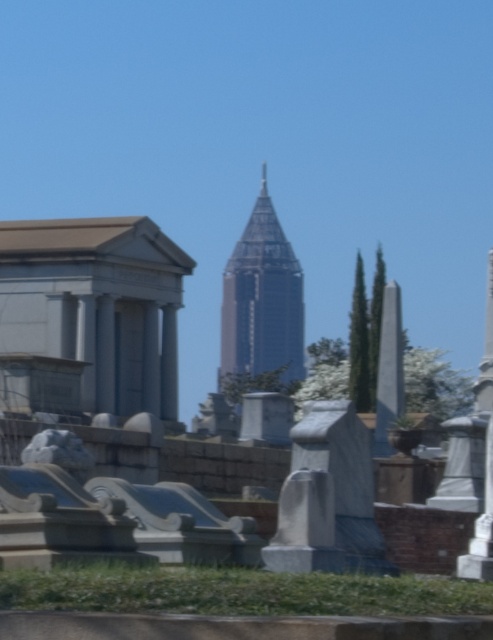
Who is higher up, shiny glass skyscraper at center or white marble obelisk at right?

shiny glass skyscraper at center is above.

In the scene shown: Is shiny glass skyscraper at center below white marble obelisk at right?

Actually, shiny glass skyscraper at center is above white marble obelisk at right.

Locate an element on the screen. The width and height of the screenshot is (493, 640). shiny glass skyscraper at center is located at coordinates (261, 307).